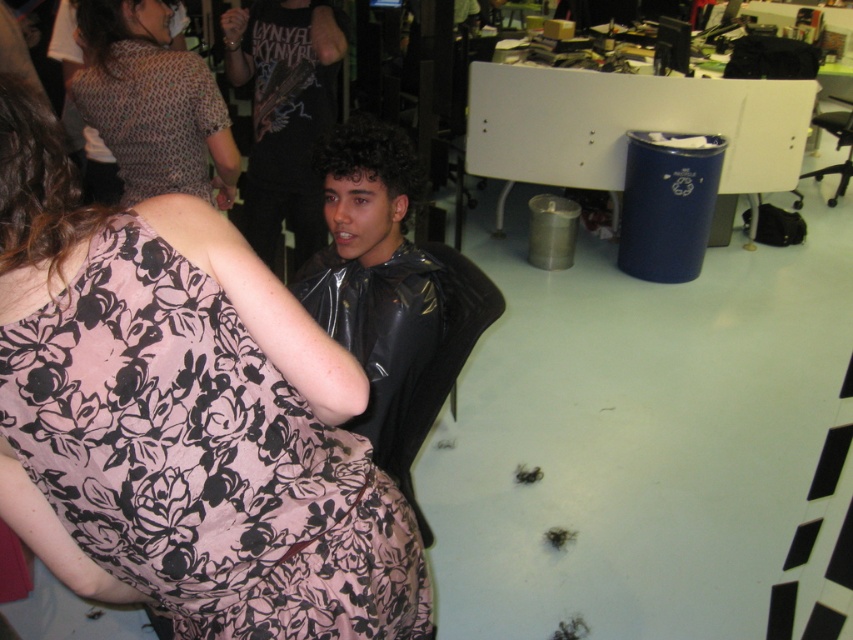
Question: Which is farther from the black leather jacket at center?

Choices:
 (A) black leather chair at center
 (B) floral-patterned fabric dress at center
 (C) black plastic chair at upper right
 (D) patterned fabric blouse at upper left

Answer: (C)

Question: Is patterned fabric blouse at upper left wider than black plastic chair at upper right?

Choices:
 (A) yes
 (B) no

Answer: (B)

Question: Is patterned fabric blouse at upper left in front of black leather chair at center?

Choices:
 (A) no
 (B) yes

Answer: (A)

Question: Which object appears farthest from the camera in this image?

Choices:
 (A) black leather jacket at center
 (B) patterned fabric blouse at upper left
 (C) black plastic chair at upper right

Answer: (C)

Question: Which of the following is the closest to the observer?

Choices:
 (A) (386, 285)
 (B) (390, 516)

Answer: (B)

Question: Does floral-patterned fabric dress at center appear over patterned fabric blouse at upper left?

Choices:
 (A) yes
 (B) no

Answer: (B)